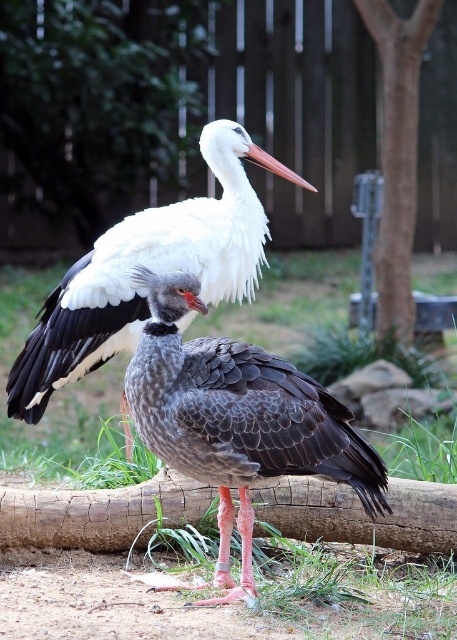
You are a birdwatcher observing the two birds in the image. You notice gray matte feathers at center. Where exactly are these feathers located in the image?

The gray matte feathers at center are located at point (237, 419) in the image.

You are a photographer trying to capture both the gray matte feathers at center and the white feathered stork at upper center in a single frame. Based on their sizes, which bird should you focus on to ensure both fit in the frame?

The gray matte feathers at center is thinner than the white feathered stork at upper center, so you should focus on the larger white feathered stork at upper center to ensure both birds fit in the frame.

You are a birdwatcher observing the scene. You notice the gray matte feathers at center and the white feathered stork at upper center. Which bird is closer to you?

The gray matte feathers at center is positioned under the white feathered stork at upper center, so the gray matte feathers at center is closer to you.